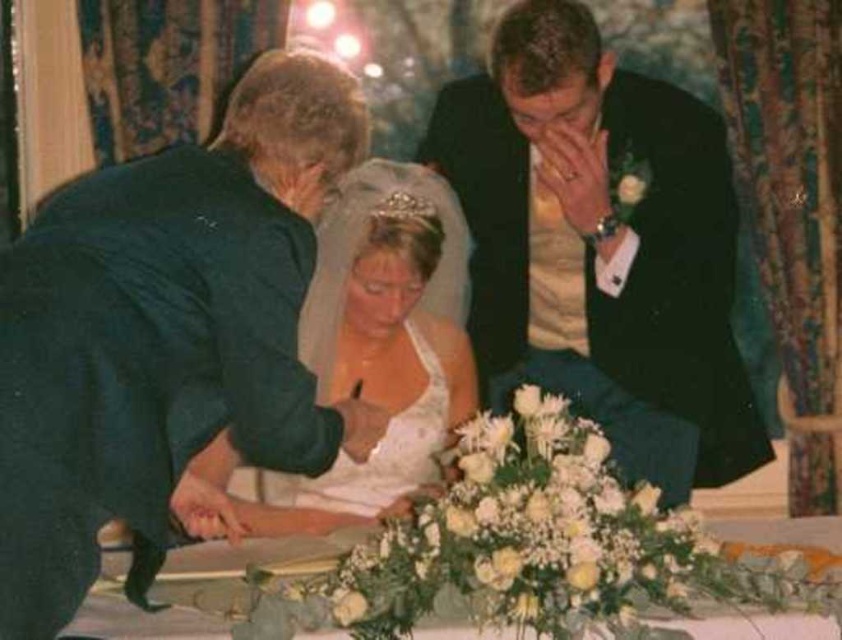
Question: Which point is farther from the camera taking this photo?

Choices:
 (A) (390, 477)
 (B) (145, 308)

Answer: (A)

Question: Does white satin dress at center have a lesser width compared to white satin wedding dress at center?

Choices:
 (A) no
 (B) yes

Answer: (A)

Question: Does black satin suit at upper right have a larger size compared to white floral arrangement at center?

Choices:
 (A) no
 (B) yes

Answer: (B)

Question: Is white satin dress at left thinner than white satin wedding dress at center?

Choices:
 (A) yes
 (B) no

Answer: (B)

Question: Which of the following is the farthest from the observer?

Choices:
 (A) (334, 209)
 (B) (136, 630)
 (C) (286, 179)

Answer: (A)

Question: Which point is closer to the camera taking this photo?

Choices:
 (A) (251, 561)
 (B) (353, 205)
 (C) (429, 464)
 (D) (78, 301)

Answer: (D)